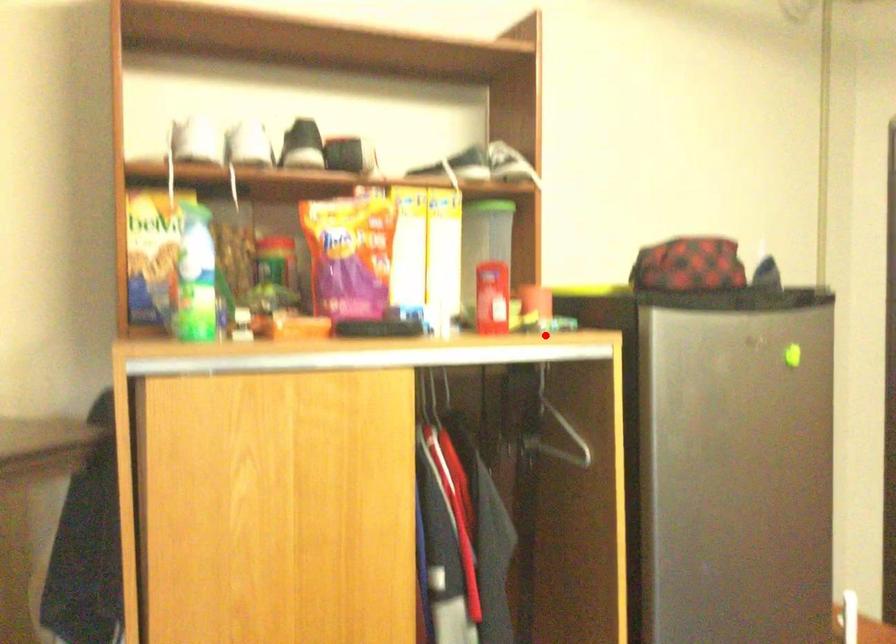
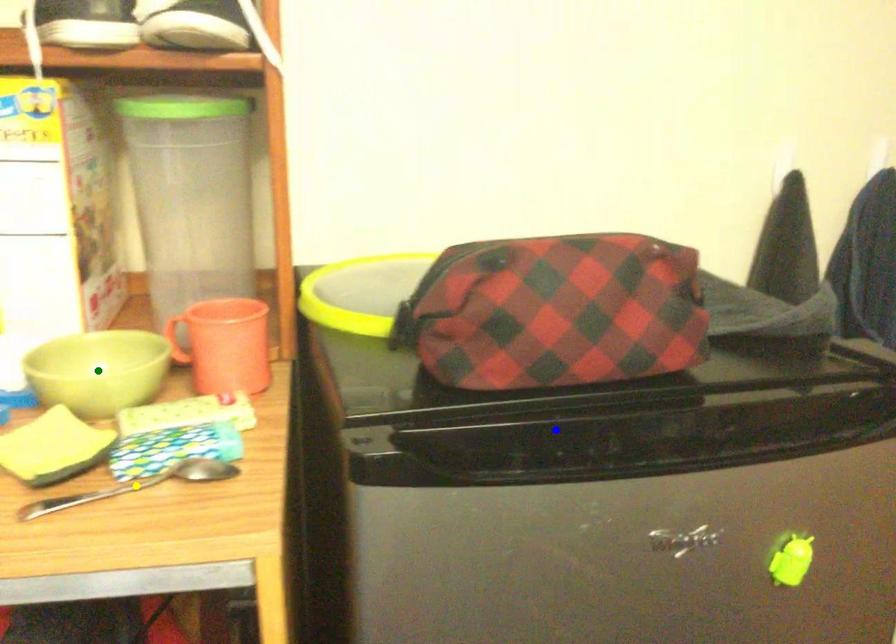
Question: I am providing you with two images of the same scene from different viewpoints. A red point is marked on the first image. You are given multiple points on the second image. Which spot in image 2 lines up with the point in image 1?

Choices:
 (A) blue point
 (B) yellow point
 (C) green point

Answer: (B)